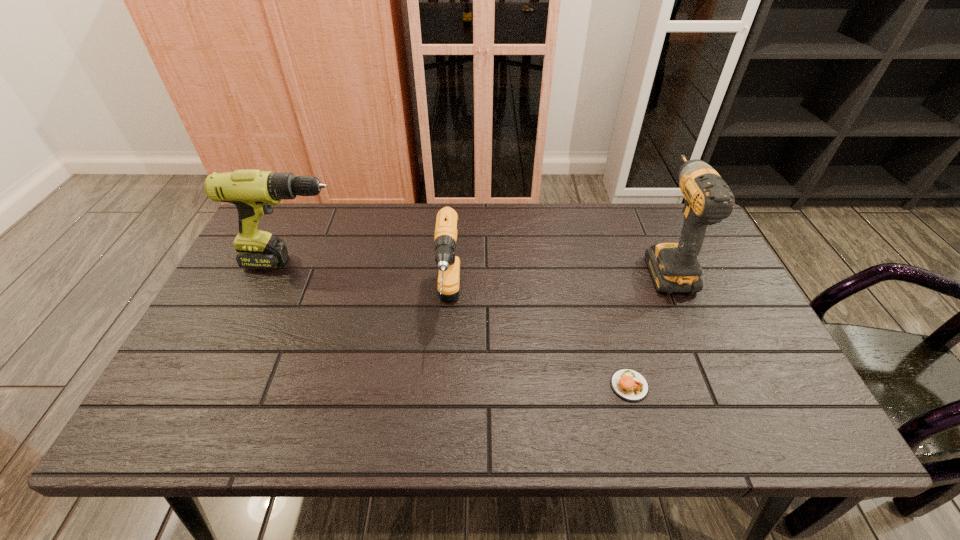
Where is `blank space at the far right corner of the desktop`? This screenshot has height=540, width=960. blank space at the far right corner of the desktop is located at coordinates (662, 210).

The image size is (960, 540). I want to click on free spot between the leftmost drill and the nearest object, so click(x=463, y=323).

I want to click on vacant space that is in between the rightmost drill and the nearest object, so click(648, 325).

Where is `free area in between the leftmost object and the second shortest object`? Image resolution: width=960 pixels, height=540 pixels. free area in between the leftmost object and the second shortest object is located at coordinates 372,283.

The width and height of the screenshot is (960, 540). Identify the location of vacant area that lies between the second object from left to right and the rightmost drill. (558, 285).

This screenshot has width=960, height=540. I want to click on free spot between the second drill from right to left and the shortest object, so click(539, 345).

Image resolution: width=960 pixels, height=540 pixels. I want to click on blank region between the leftmost object and the second object from left to right, so (x=372, y=283).

The image size is (960, 540). I want to click on empty location between the rightmost drill and the leftmost object, so click(481, 264).

This screenshot has width=960, height=540. I want to click on free space that is in between the leftmost object and the nearest object, so click(x=463, y=323).

The image size is (960, 540). Find the location of `free space between the nearest object and the shortest drill`. free space between the nearest object and the shortest drill is located at coordinates (539, 345).